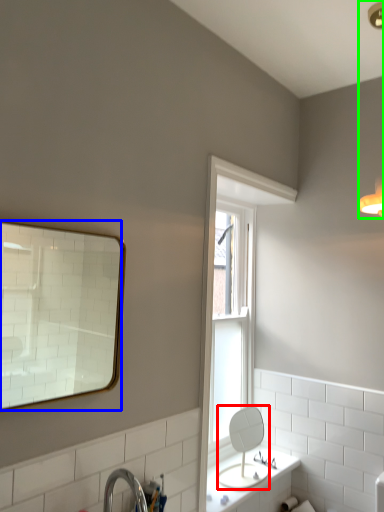
Question: Which object is positioned farthest from mirror (highlighted by a red box)? Select from mirror (highlighted by a blue box) and light fixture (highlighted by a green box).

Choices:
 (A) mirror
 (B) light fixture

Answer: (A)